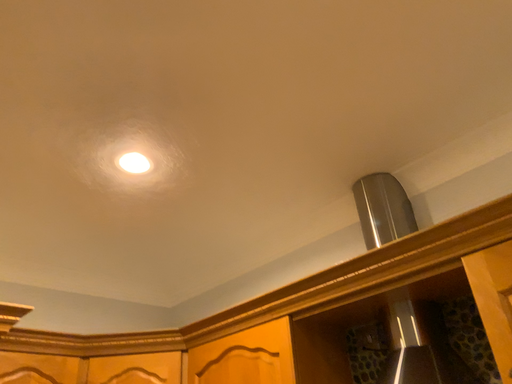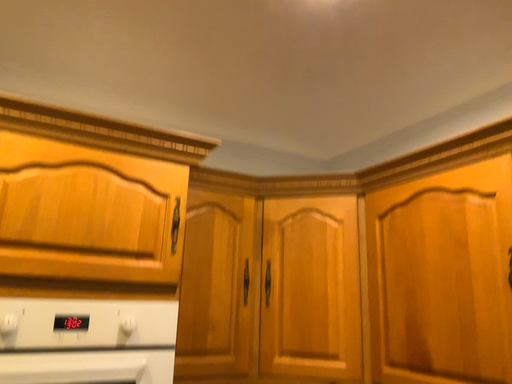
Question: How did the camera likely rotate when shooting the video?

Choices:
 (A) rotated upward
 (B) rotated downward

Answer: (B)